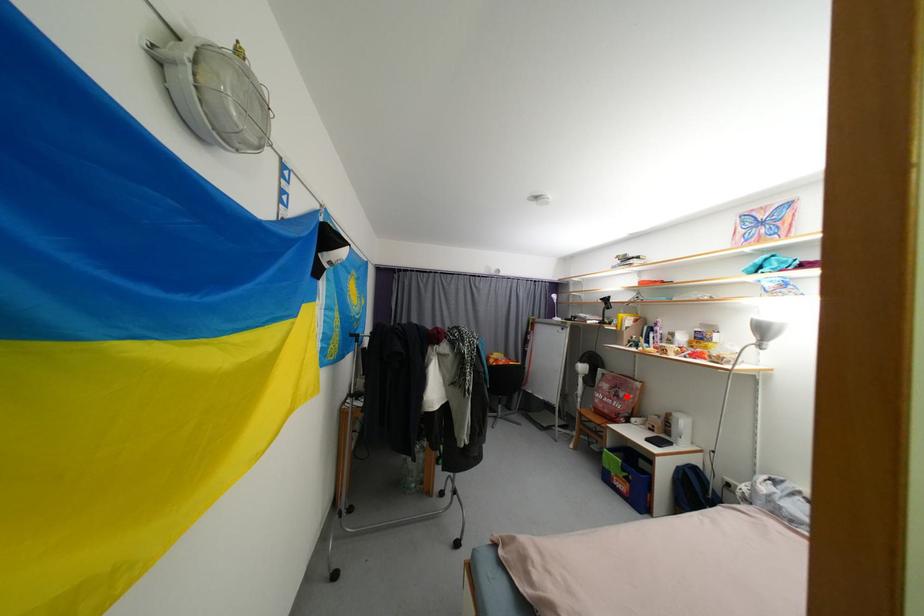
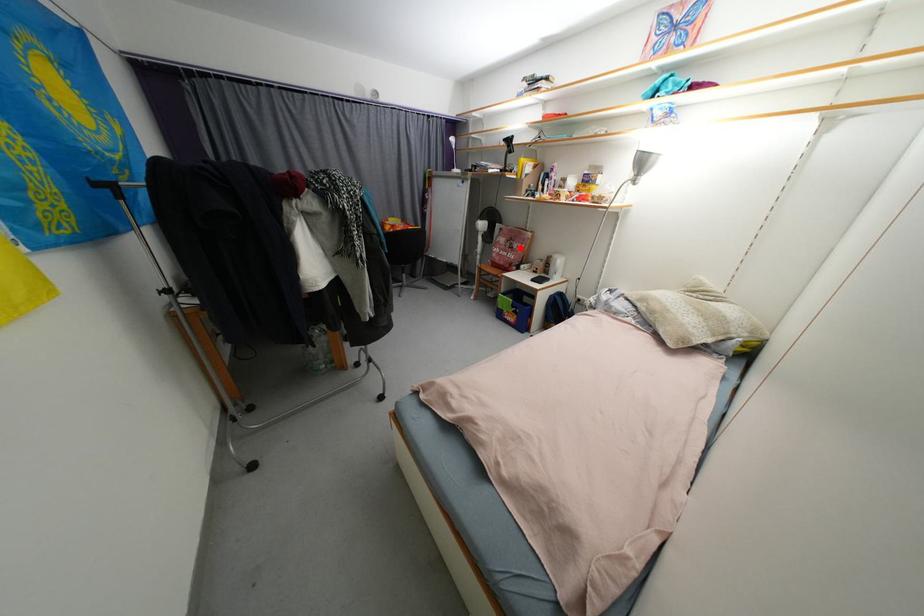
I am providing you with two images of the same scene from different viewpoints. A red point is marked on the first image and another point is marked on the second image. Do the highlighted points in image1 and image2 indicate the same real-world spot?

Yes